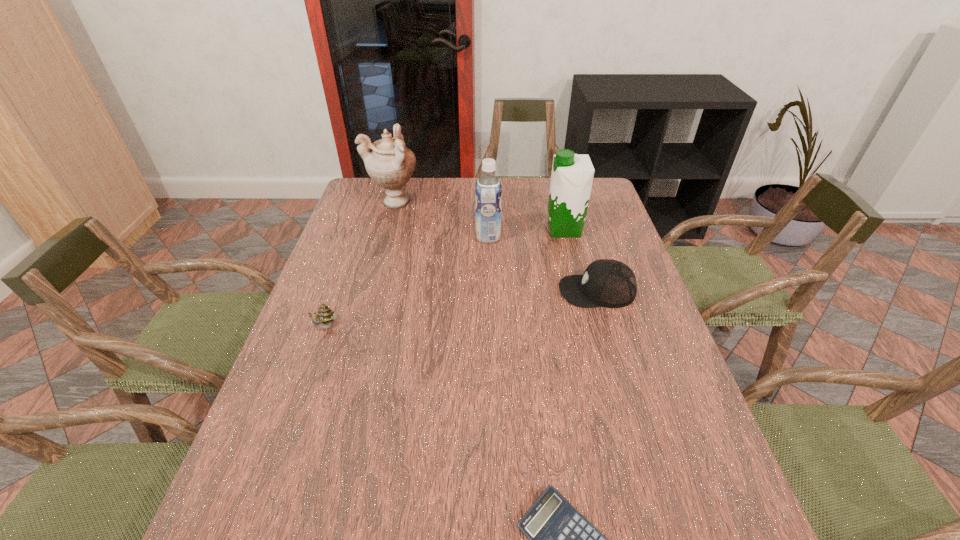
Locate an element on the screen. The width and height of the screenshot is (960, 540). cap that is at the right edge is located at coordinates [608, 283].

Locate an element on the screen. The width and height of the screenshot is (960, 540). object positioned at the far left corner is located at coordinates (390, 164).

In the image, there is a desktop. In order to click on blank space at the far edge in this screenshot , I will do `click(467, 203)`.

Where is `vacant area at the left edge of the desktop`? This screenshot has width=960, height=540. vacant area at the left edge of the desktop is located at coordinates (377, 264).

What are the coordinates of `vacant space at the right edge of the desktop` in the screenshot? It's located at (660, 373).

At what (x,y) coordinates should I click in order to perform the action: click on vacant space at the far left corner. Please return your answer as a coordinate pair (x, y). Looking at the image, I should click on (377, 191).

You are a GUI agent. You are given a task and a screenshot of the screen. Output one action in this format:
    pyautogui.click(x=<x>, y=<y>)
    Task: Click on the free space that is in between the snail and the cap
    This screenshot has height=540, width=960.
    Given the screenshot: What is the action you would take?
    pyautogui.click(x=462, y=309)

This screenshot has height=540, width=960. I want to click on blank region between the right soya milk and the cap, so click(581, 260).

Image resolution: width=960 pixels, height=540 pixels. I want to click on vacant area between the fifth farthest object and the farthest object, so click(360, 265).

Find the location of `free space between the urn and the third nearest object`. free space between the urn and the third nearest object is located at coordinates (495, 246).